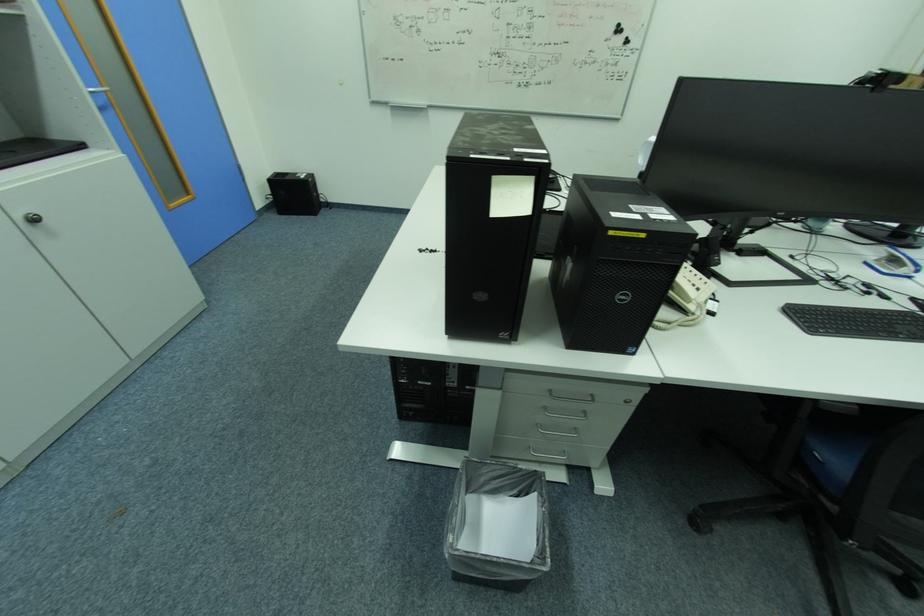
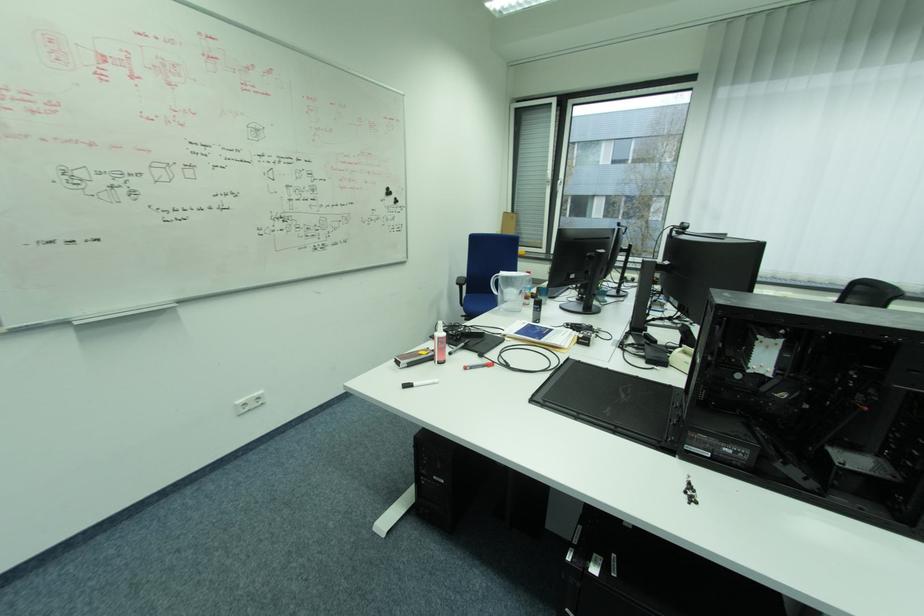
In the second image, find the point that corresponds to pixel 623 29 in the first image.

(392, 192)